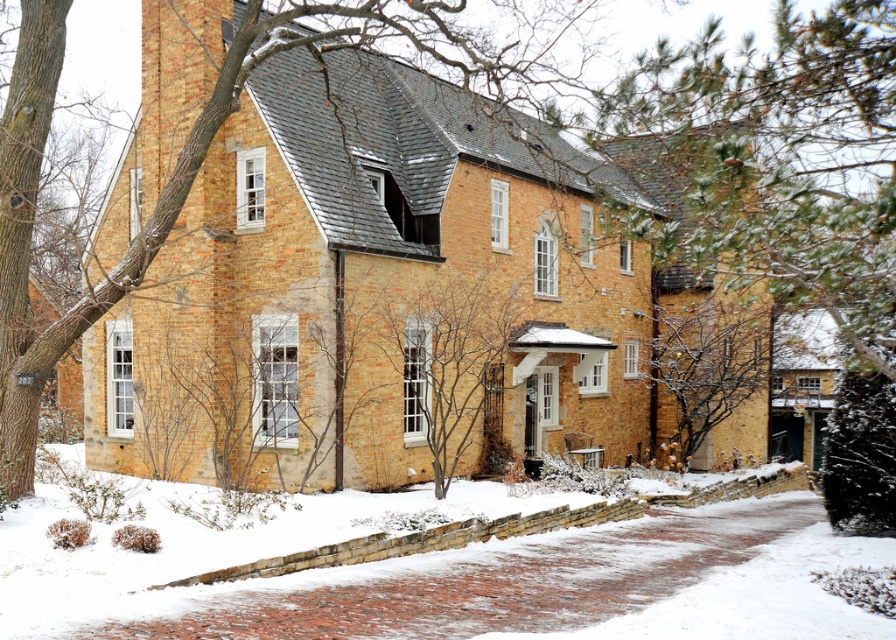
You are standing in front of the house and want to walk towards the white powdery snow at lower center. Which direction should you walk to reach it?

The white powdery snow at lower center is located at point 0.897 on the x axis and 0.499 on the y axis. Since the lower center is towards the bottom middle of the image, you should walk forward and slightly to the right to reach it.

You are a delivery person trying to reach the front door of the house. You see the white powdery snow at lower center and the bare branches at center. Which path is wider for your delivery cart to pass through?

The white powdery snow at lower center might be wider than the bare branches at center, so the delivery cart can pass through the white powdery snow at lower center more easily.